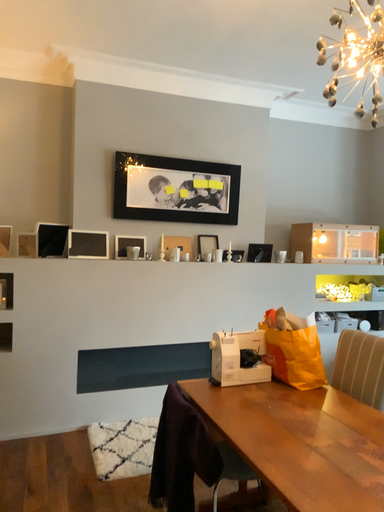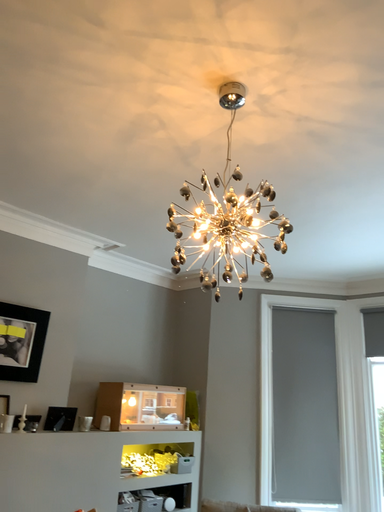
Question: Which way did the camera rotate in the video?

Choices:
 (A) rotated left
 (B) rotated right

Answer: (B)